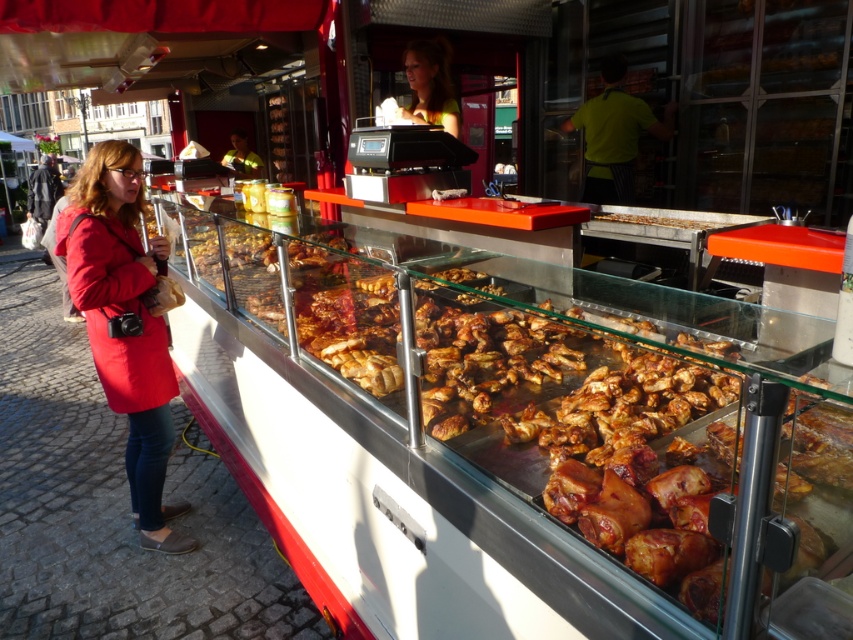
Between matte red coat at left and blonde hair at upper center, which one is positioned higher?

blonde hair at upper center is higher up.

Can you confirm if matte red coat at left is taller than blonde hair at upper center?

Yes, matte red coat at left is taller than blonde hair at upper center.

Does point (125, 358) come closer to viewer compared to point (419, 54)?

That is True.

The image size is (853, 640). I want to click on matte red coat at left, so click(x=125, y=323).

Looking at this image, can you confirm if brown crispy bread at center is positioned to the left of reflective yellow jacket at center?

Incorrect, brown crispy bread at center is not on the left side of reflective yellow jacket at center.

Is point (703, 227) positioned in front of point (244, 147)?

Yes, point (703, 227) is closer to viewer.

Between point (697, 224) and point (252, 170), which one is positioned behind?

Point (252, 170)

At what (x,y) coordinates should I click in order to perform the action: click on brown crispy bread at center. Please return your answer as a coordinate pair (x, y). Image resolution: width=853 pixels, height=640 pixels. Looking at the image, I should click on (657, 220).

Does blonde hair at upper center have a lesser width compared to reflective yellow jacket at center?

Yes, blonde hair at upper center is thinner than reflective yellow jacket at center.

Between blonde hair at upper center and reflective yellow jacket at center, which one has more height?

Standing taller between the two is blonde hair at upper center.

Find the location of a particular element. The width and height of the screenshot is (853, 640). blonde hair at upper center is located at coordinates (430, 84).

Find the location of a particular element. This screenshot has height=640, width=853. blonde hair at upper center is located at coordinates (430, 84).